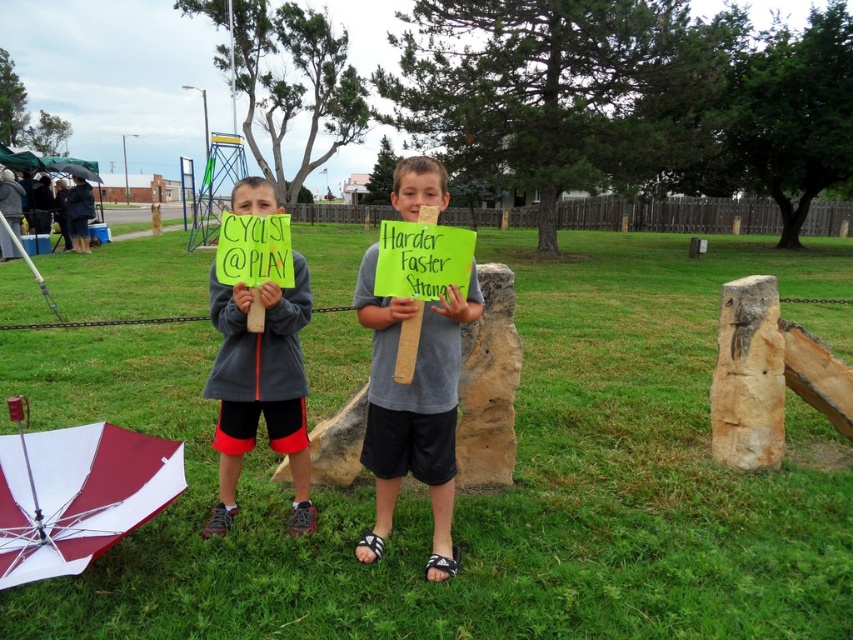
Based on the photo, you are a photographer trying to capture a photo of both the gray fabric shirt at center and the maroon and white fabric umbrella at center. Since you want to ensure both are visible, which object should you focus on first to account for their sizes?

The gray fabric shirt at center is taller than the maroon and white fabric umbrella at center, so you should focus on the gray fabric shirt at center first to ensure its full height is captured before adjusting for the smaller umbrella.